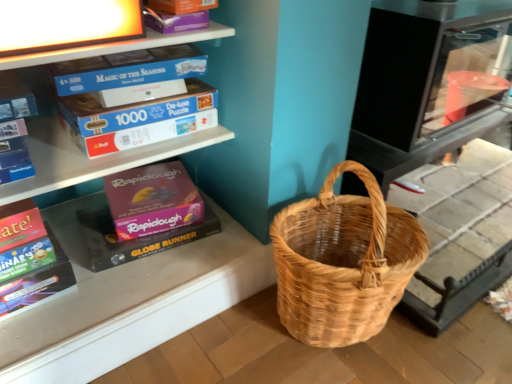
What do you see at coordinates (30, 260) in the screenshot? This screenshot has width=512, height=384. I see `multicolored cardboard book at lower left` at bounding box center [30, 260].

Describe the element at coordinates (343, 262) in the screenshot. The height and width of the screenshot is (384, 512). I see `natural woven picnic basket at lower right` at that location.

Where is `multicolored cardboard book at lower left`? The image size is (512, 384). multicolored cardboard book at lower left is located at coordinates (30, 260).

Could you tell me if multicolored cardboard book at lower left is facing natural woven picnic basket at lower right?

No, multicolored cardboard book at lower left is not facing towards natural woven picnic basket at lower right.

From the image's perspective, which object appears higher, multicolored cardboard book at lower left or natural woven picnic basket at lower right?

multicolored cardboard book at lower left.

Where is `paperback book that is above the natural woven picnic basket at lower right (from a real-world perspective)`? paperback book that is above the natural woven picnic basket at lower right (from a real-world perspective) is located at coordinates (30, 260).

Is multicolored cardboard book at lower left taller or shorter than natural woven picnic basket at lower right?

In the image, multicolored cardboard book at lower left appears to be shorter than natural woven picnic basket at lower right.

How different are the orientations of natural woven picnic basket at lower right and white cardboard puzzle boxes at upper left in degrees?

natural woven picnic basket at lower right and white cardboard puzzle boxes at upper left are facing 5.84 degrees away from each other.

Is natural woven picnic basket at lower right wider than white cardboard puzzle boxes at upper left?

Incorrect, the width of natural woven picnic basket at lower right does not surpass that of white cardboard puzzle boxes at upper left.

Is natural woven picnic basket at lower right looking in the opposite direction of white cardboard puzzle boxes at upper left?

Correct, natural woven picnic basket at lower right is looking away from white cardboard puzzle boxes at upper left.

Does point (338, 279) come in front of point (162, 39)?

Yes.

From a real-world perspective, which is physically above, multicolored cardboard book at lower left or white cardboard puzzle boxes at upper left?

From a 3D spatial view, white cardboard puzzle boxes at upper left is above.

In terms of width, does multicolored cardboard book at lower left look wider or thinner when compared to white cardboard puzzle boxes at upper left?

Clearly, multicolored cardboard book at lower left has less width compared to white cardboard puzzle boxes at upper left.

How distant is multicolored cardboard book at lower left from white cardboard puzzle boxes at upper left?

7.76 inches.

Is multicolored cardboard book at lower left beside white cardboard puzzle boxes at upper left?

No.

Find the location of a particular element. paperback book above the natural woven picnic basket at lower right (from a real-world perspective) is located at coordinates (30, 260).

Can you confirm if natural woven picnic basket at lower right is wider than multicolored cardboard book at lower left?

Correct, the width of natural woven picnic basket at lower right exceeds that of multicolored cardboard book at lower left.

Which of these two, natural woven picnic basket at lower right or multicolored cardboard book at lower left, stands shorter?

With less height is multicolored cardboard book at lower left.

Which is in front, natural woven picnic basket at lower right or multicolored cardboard book at lower left?

natural woven picnic basket at lower right.

From the image's perspective, relative to multicolored cardboard book at lower left, is white cardboard puzzle boxes at upper left above or below?

white cardboard puzzle boxes at upper left is above multicolored cardboard book at lower left.

Which is more to the right, white cardboard puzzle boxes at upper left or multicolored cardboard book at lower left?

white cardboard puzzle boxes at upper left.

In the scene shown: Would you say white cardboard puzzle boxes at upper left is inside or outside multicolored cardboard book at lower left?

white cardboard puzzle boxes at upper left is located beyond the bounds of multicolored cardboard book at lower left.

Is white cardboard puzzle boxes at upper left to the left or to the right of natural woven picnic basket at lower right in the image?

white cardboard puzzle boxes at upper left is positioned on natural woven picnic basket at lower right's left side.

Does white cardboard puzzle boxes at upper left have a smaller size compared to natural woven picnic basket at lower right?

Yes.

How many degrees apart are the facing directions of white cardboard puzzle boxes at upper left and natural woven picnic basket at lower right?

white cardboard puzzle boxes at upper left and natural woven picnic basket at lower right are facing 5.84 degrees away from each other.

From a real-world perspective, is white cardboard puzzle boxes at upper left beneath natural woven picnic basket at lower right?

No.

Where is `paperback book above the natural woven picnic basket at lower right (from a real-world perspective)`? This screenshot has height=384, width=512. paperback book above the natural woven picnic basket at lower right (from a real-world perspective) is located at coordinates (30, 260).

This screenshot has width=512, height=384. Find the location of `shelf that appears on the left of natural woven picnic basket at lower right`. shelf that appears on the left of natural woven picnic basket at lower right is located at coordinates (90, 159).

Which object lies nearer to the anchor point white cardboard puzzle boxes at upper left, multicolored cardboard book at lower left or natural woven picnic basket at lower right?

multicolored cardboard book at lower left is positioned closer to the anchor white cardboard puzzle boxes at upper left.

From the image, which object appears to be farther from white cardboard puzzle boxes at upper left, natural woven picnic basket at lower right or multicolored cardboard book at lower left?

natural woven picnic basket at lower right lies further to white cardboard puzzle boxes at upper left than the other object.

Looking at the image, which one is located closer to natural woven picnic basket at lower right, white cardboard puzzle boxes at upper left or multicolored cardboard book at lower left?

The object closer to natural woven picnic basket at lower right is white cardboard puzzle boxes at upper left.

Estimate the real-world distances between objects in this image. Which object is closer to natural woven picnic basket at lower right, multicolored cardboard book at lower left or white cardboard puzzle boxes at upper left?

Based on the image, white cardboard puzzle boxes at upper left appears to be nearer to natural woven picnic basket at lower right.

Estimate the real-world distances between objects in this image. Which object is further from multicolored cardboard book at lower left, natural woven picnic basket at lower right or white cardboard puzzle boxes at upper left?

natural woven picnic basket at lower right is further to multicolored cardboard book at lower left.

Based on their spatial positions, is white cardboard puzzle boxes at upper left or natural woven picnic basket at lower right further from multicolored cardboard book at lower left?

natural woven picnic basket at lower right.

You are a GUI agent. You are given a task and a screenshot of the screen. Output one action in this format:
    pyautogui.click(x=<x>, y=<y>)
    Task: Click on the shelf between multicolored cardboard book at lower left and natural woven picnic basket at lower right
    The width and height of the screenshot is (512, 384).
    Given the screenshot: What is the action you would take?
    pyautogui.click(x=90, y=159)